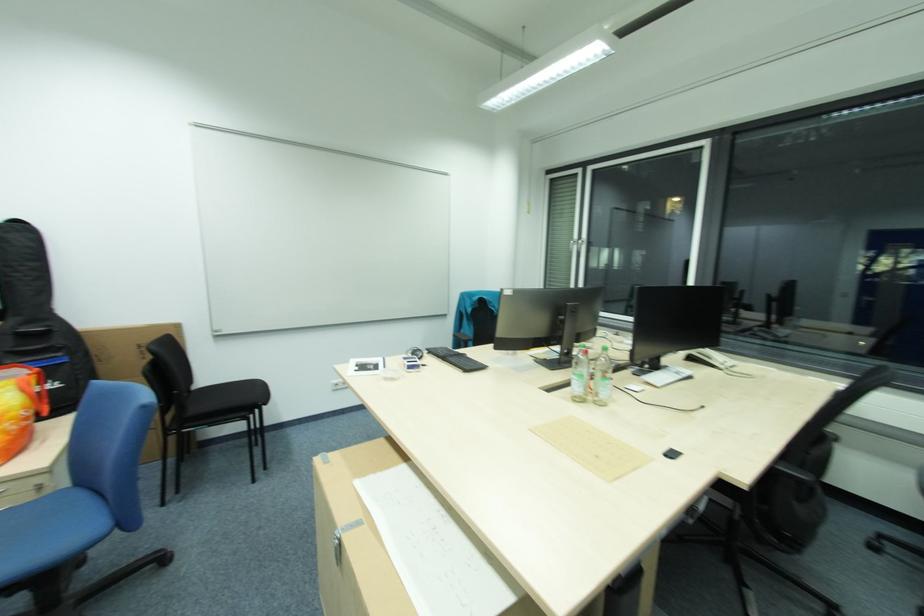
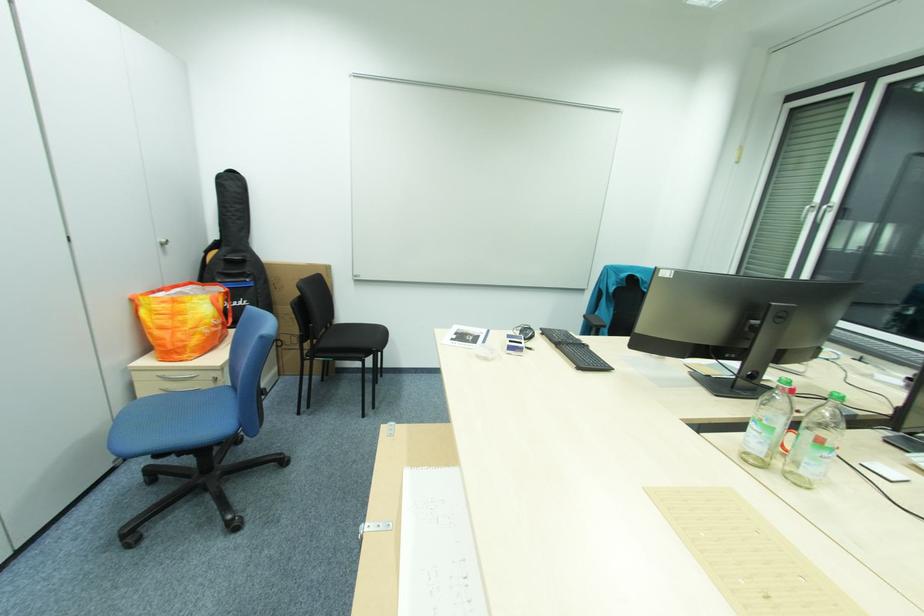
Question: The first image is from the beginning of the video and the second image is from the end. How did the camera likely rotate when shooting the video?

Choices:
 (A) Left
 (B) Right
 (C) Up
 (D) Down

Answer: (A)